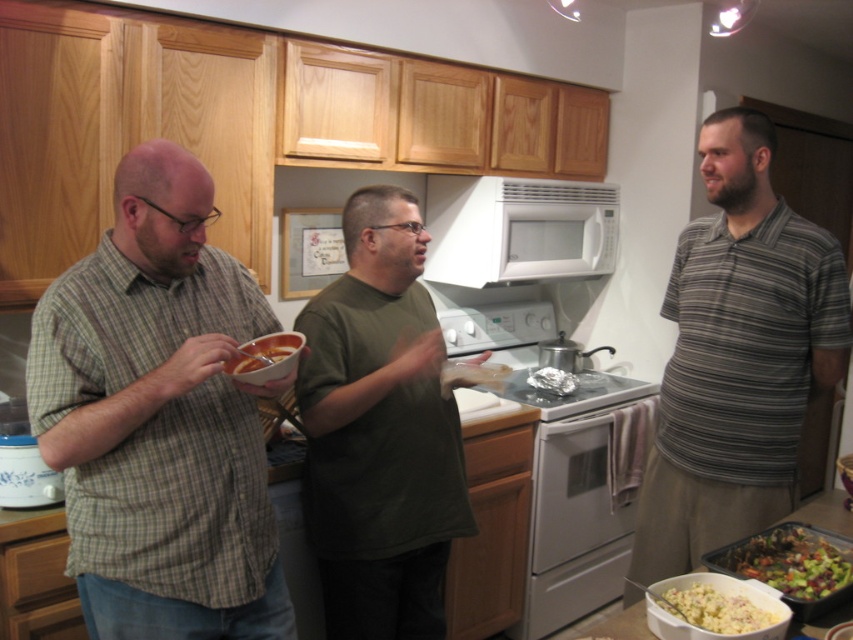
Question: Which point is closer to the camera?

Choices:
 (A) pyautogui.click(x=294, y=333)
 (B) pyautogui.click(x=699, y=595)
 (C) pyautogui.click(x=466, y=372)

Answer: (B)

Question: Is white glossy stove at center bigger than green leafy salad at lower right?

Choices:
 (A) yes
 (B) no

Answer: (A)

Question: Is green leafy salad at lower right to the left of shiny silver pot at center from the viewer's perspective?

Choices:
 (A) no
 (B) yes

Answer: (A)

Question: Which point is closer to the camera taking this photo?

Choices:
 (A) (787, 401)
 (B) (727, 602)
 (C) (512, 252)
 (D) (311, 368)

Answer: (B)

Question: Can you confirm if green matte shirt at center is positioned to the right of matte ceramic bowl at left?

Choices:
 (A) yes
 (B) no

Answer: (A)

Question: Among these objects, which one is farthest from the camera?

Choices:
 (A) striped cotton shirt at center
 (B) green matte shirt at center
 (C) matte ceramic bowl at left
 (D) yellow creamy casserole at lower right

Answer: (A)